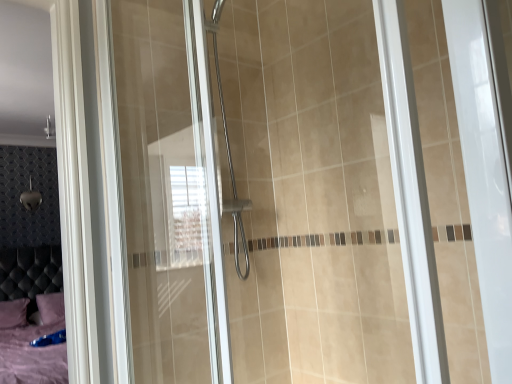
Question: Considering the relative sizes of purple fabric pillow at lower left, acting as the 2th pillow starting from the right, and purple fabric pillow at lower left, the first pillow viewed from the right, in the image provided, is purple fabric pillow at lower left, acting as the 2th pillow starting from the right, bigger than purple fabric pillow at lower left, the first pillow viewed from the right,?

Choices:
 (A) no
 (B) yes

Answer: (B)

Question: Can you confirm if purple fabric pillow at lower left, acting as the 2th pillow starting from the right, is shorter than purple fabric pillow at lower left, the second pillow from the left?

Choices:
 (A) yes
 (B) no

Answer: (B)

Question: From the image's perspective, is purple fabric pillow at lower left, acting as the 2th pillow starting from the right, below purple fabric pillow at lower left, the second pillow from the left?

Choices:
 (A) yes
 (B) no

Answer: (A)

Question: Can you confirm if purple fabric pillow at lower left, acting as the 2th pillow starting from the right, is positioned to the left of purple fabric pillow at lower left, the second pillow from the left?

Choices:
 (A) no
 (B) yes

Answer: (B)

Question: Is purple fabric pillow at lower left, acting as the 2th pillow starting from the right, wider than purple fabric pillow at lower left, the first pillow viewed from the right?

Choices:
 (A) no
 (B) yes

Answer: (B)

Question: Is purple fabric pillow at lower left, which appears as the 1th pillow when viewed from the left, oriented towards purple fabric pillow at lower left, the first pillow viewed from the right?

Choices:
 (A) yes
 (B) no

Answer: (B)

Question: Is purple fabric pillow at lower left, which appears as the 1th pillow when viewed from the left, to the left of transparent glass shower door at center from the viewer's perspective?

Choices:
 (A) yes
 (B) no

Answer: (A)

Question: Is purple fabric pillow at lower left, which appears as the 1th pillow when viewed from the left, oriented towards transparent glass shower door at center?

Choices:
 (A) yes
 (B) no

Answer: (A)

Question: Is purple fabric pillow at lower left, acting as the 2th pillow starting from the right, next to transparent glass shower door at center and touching it?

Choices:
 (A) no
 (B) yes

Answer: (A)

Question: Is purple fabric pillow at lower left, acting as the 2th pillow starting from the right, outside transparent glass shower door at center?

Choices:
 (A) no
 (B) yes

Answer: (B)

Question: Does purple fabric pillow at lower left, acting as the 2th pillow starting from the right, have a smaller size compared to transparent glass shower door at center?

Choices:
 (A) yes
 (B) no

Answer: (A)

Question: From a real-world perspective, is purple fabric pillow at lower left, which appears as the 1th pillow when viewed from the left, physically above transparent glass shower door at center?

Choices:
 (A) no
 (B) yes

Answer: (A)

Question: Is transparent glass shower door at center in front of purple fabric pillow at lower left, acting as the 2th pillow starting from the right?

Choices:
 (A) no
 (B) yes

Answer: (B)